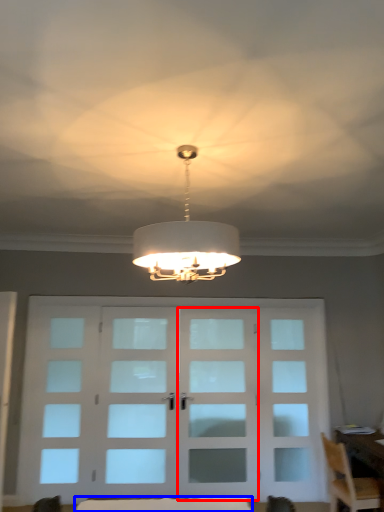
Question: Which object appears closest to the camera in this image, screen door (highlighted by a red box) or furniture (highlighted by a blue box)?

Choices:
 (A) screen door
 (B) furniture

Answer: (B)